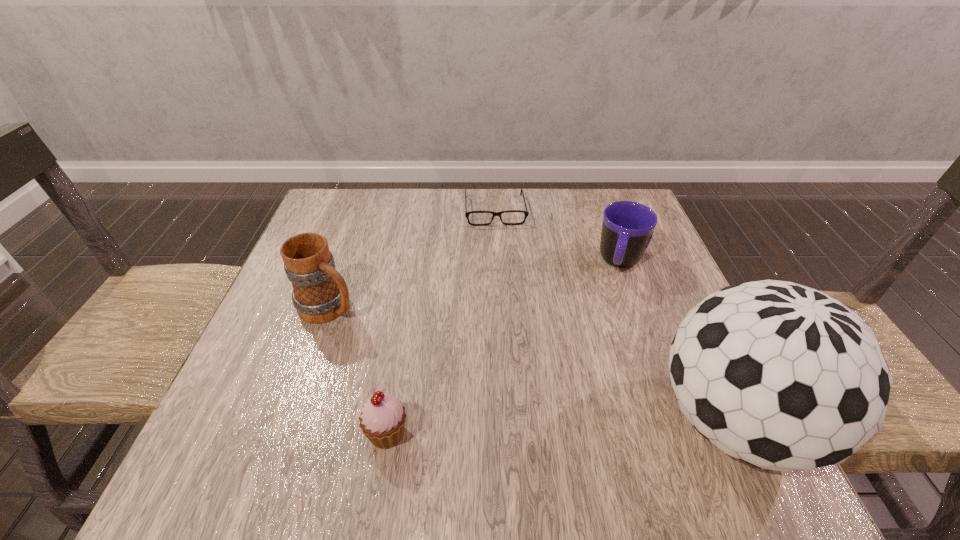
Identify the location of cupcake. Image resolution: width=960 pixels, height=540 pixels. [382, 420].

Where is `the tallest object`? Image resolution: width=960 pixels, height=540 pixels. the tallest object is located at coordinates (781, 376).

This screenshot has height=540, width=960. I want to click on the left mug, so (x=320, y=294).

The width and height of the screenshot is (960, 540). I want to click on the third nearest object, so click(x=320, y=294).

Image resolution: width=960 pixels, height=540 pixels. I want to click on the farthest object, so (526, 212).

Identify the location of spectacles. (526, 212).

This screenshot has width=960, height=540. In order to click on the shorter mug in this screenshot , I will do [627, 229].

Locate an element on the screen. Image resolution: width=960 pixels, height=540 pixels. the farther mug is located at coordinates pos(627,229).

You are a GUI agent. You are given a task and a screenshot of the screen. Output one action in this format:
    pyautogui.click(x=<x>, y=<y>)
    Task: Click on the vacant area located 0.110m on the back of the fourth object from right to left
    This screenshot has height=540, width=960.
    Given the screenshot: What is the action you would take?
    coord(399,362)

Identify the location of free space located on the back of the soccer ball. (669, 284).